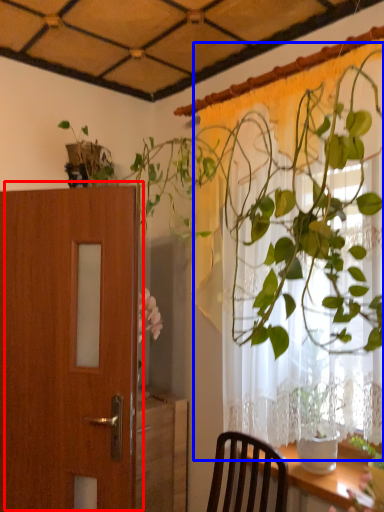
Question: Which object is further to the camera taking this photo, door (highlighted by a red box) or curtain (highlighted by a blue box)?

Choices:
 (A) door
 (B) curtain

Answer: (A)